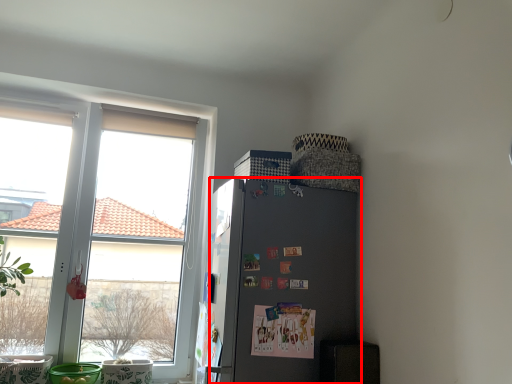
Question: From the image's perspective, what is the correct spatial positioning of refrigerator (annotated by the red box) in reference to window?

Choices:
 (A) above
 (B) below

Answer: (B)